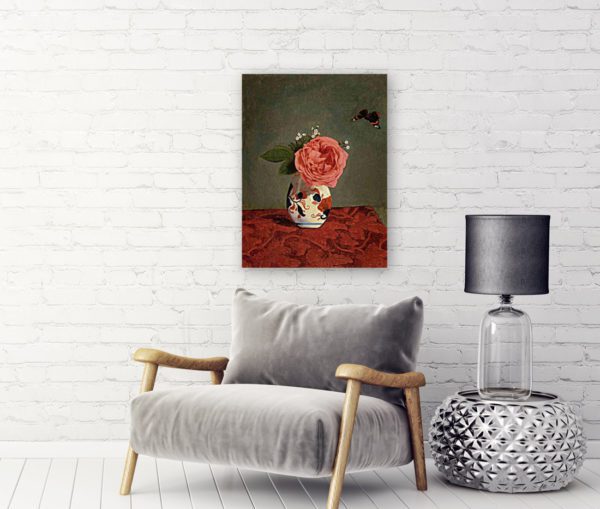
This screenshot has height=509, width=600. I want to click on light gray valour seat cushion, so click(x=271, y=416).